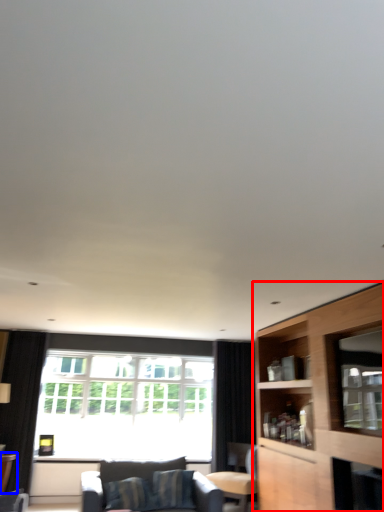
Question: Which object is closer to the camera taking this photo, cabinetry (highlighted by a red box) or table (highlighted by a blue box)?

Choices:
 (A) cabinetry
 (B) table

Answer: (A)